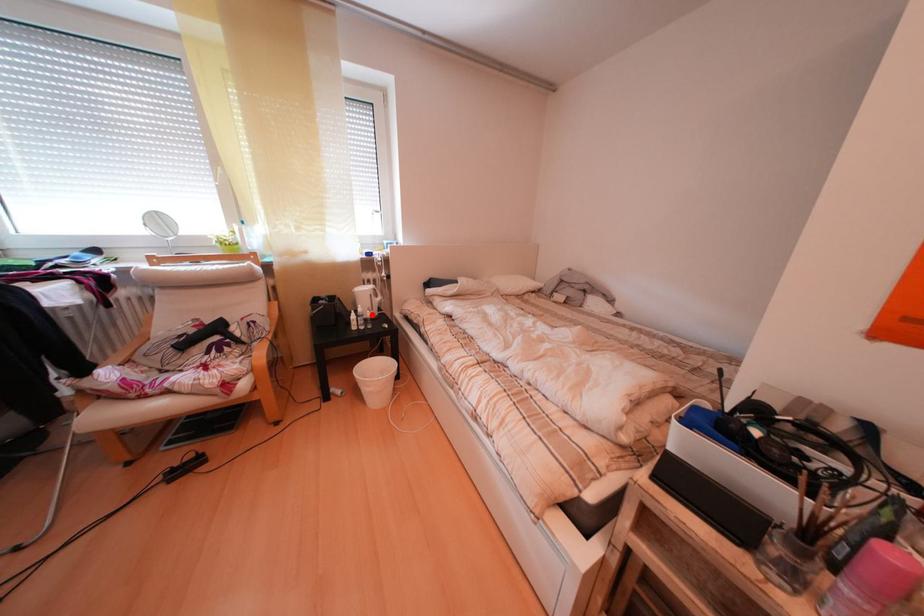
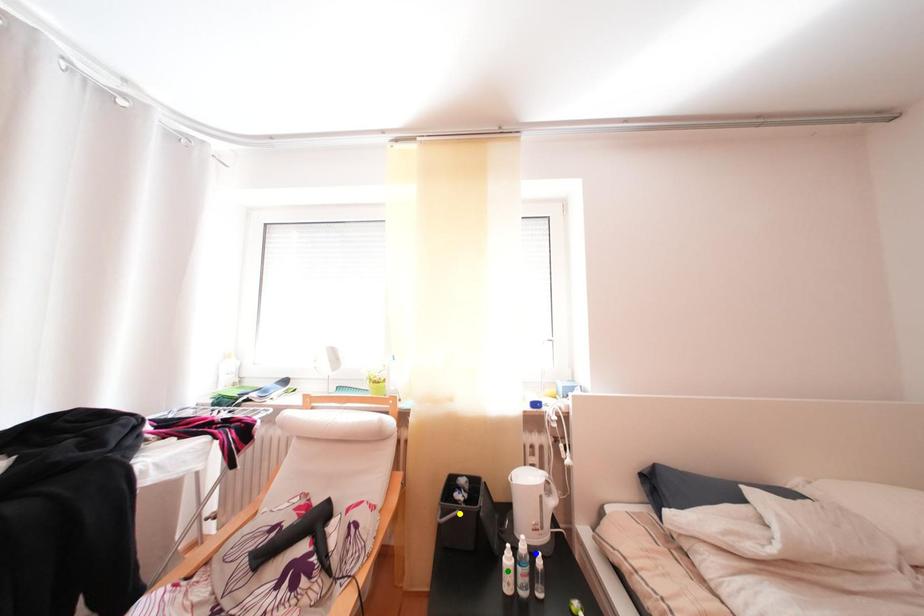
Question: I am providing you with two images of the same scene from different viewpoints. A red point is marked on the first image. You are given multiple points on the second image. In image 2, which mark is for the same physical point as the one in image 1?

Choices:
 (A) green point
 (B) blue point
 (C) yellow point

Answer: (B)